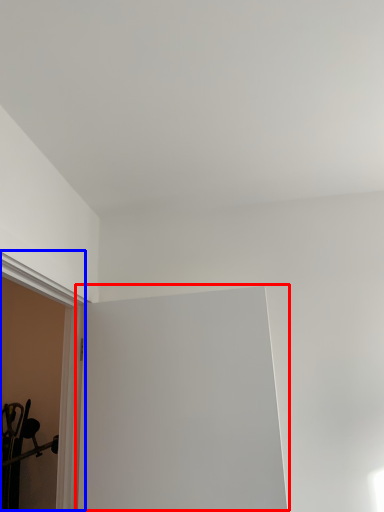
Question: Which point is further to the camera, window screen (highlighted by a red box) or window sill (highlighted by a blue box)?

Choices:
 (A) window screen
 (B) window sill

Answer: (A)